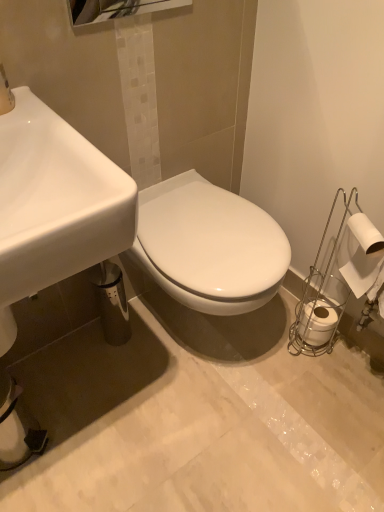
Question: From the image's perspective, is white matte toilet paper at right, arranged as the second toilet paper when viewed from the back, over polished chrome mirror at upper center?

Choices:
 (A) no
 (B) yes

Answer: (A)

Question: Considering the relative positions of white matte toilet paper at right, which ranks as the first toilet paper in top-to-bottom order, and polished chrome mirror at upper center in the image provided, is white matte toilet paper at right, which ranks as the first toilet paper in top-to-bottom order, to the left of polished chrome mirror at upper center from the viewer's perspective?

Choices:
 (A) no
 (B) yes

Answer: (A)

Question: Is white matte toilet paper at right, the 2th toilet paper in the bottom-to-top sequence, facing towards polished chrome mirror at upper center?

Choices:
 (A) yes
 (B) no

Answer: (B)

Question: Is white matte toilet paper at right, which is counted as the first toilet paper, starting from the front, looking in the opposite direction of polished chrome mirror at upper center?

Choices:
 (A) no
 (B) yes

Answer: (A)

Question: Is the position of white matte toilet paper at right, which is counted as the first toilet paper, starting from the front, more distant than that of polished chrome mirror at upper center?

Choices:
 (A) yes
 (B) no

Answer: (A)

Question: Considering the relative sizes of white matte toilet paper at right, which is counted as the first toilet paper, starting from the front, and polished chrome mirror at upper center in the image provided, is white matte toilet paper at right, which is counted as the first toilet paper, starting from the front, shorter than polished chrome mirror at upper center?

Choices:
 (A) yes
 (B) no

Answer: (B)

Question: Is polished chrome mirror at upper center smaller than white matte toilet paper at right, the 2th toilet paper in the bottom-to-top sequence?

Choices:
 (A) yes
 (B) no

Answer: (B)

Question: Can you confirm if polished chrome mirror at upper center is shorter than white matte toilet paper at right, arranged as the second toilet paper when viewed from the back?

Choices:
 (A) yes
 (B) no

Answer: (A)

Question: Is polished chrome mirror at upper center oriented away from white matte toilet paper at right, the 2th toilet paper in the bottom-to-top sequence?

Choices:
 (A) no
 (B) yes

Answer: (A)

Question: Is polished chrome mirror at upper center located outside white matte toilet paper at right, the 2th toilet paper in the bottom-to-top sequence?

Choices:
 (A) yes
 (B) no

Answer: (A)

Question: Considering the relative sizes of polished chrome mirror at upper center and white matte toilet paper at right, which ranks as the first toilet paper in top-to-bottom order, in the image provided, is polished chrome mirror at upper center wider than white matte toilet paper at right, which ranks as the first toilet paper in top-to-bottom order,?

Choices:
 (A) yes
 (B) no

Answer: (B)

Question: From a real-world perspective, is polished chrome mirror at upper center positioned over white matte toilet paper at right, which is counted as the first toilet paper, starting from the front, based on gravity?

Choices:
 (A) no
 (B) yes

Answer: (B)

Question: From a real-world perspective, is white glossy sink at lower left positioned under white matte toilet paper at right, which ranks as the first toilet paper in top-to-bottom order, based on gravity?

Choices:
 (A) no
 (B) yes

Answer: (A)